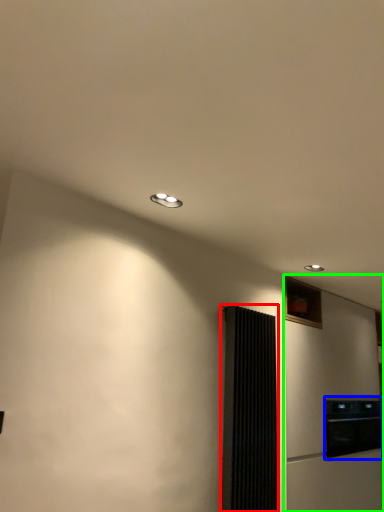
Question: Considering the real-world distances, which object is farthest from screen door (highlighted by a red box)? appliance (highlighted by a blue box) or fridge (highlighted by a green box)?

Choices:
 (A) appliance
 (B) fridge

Answer: (A)